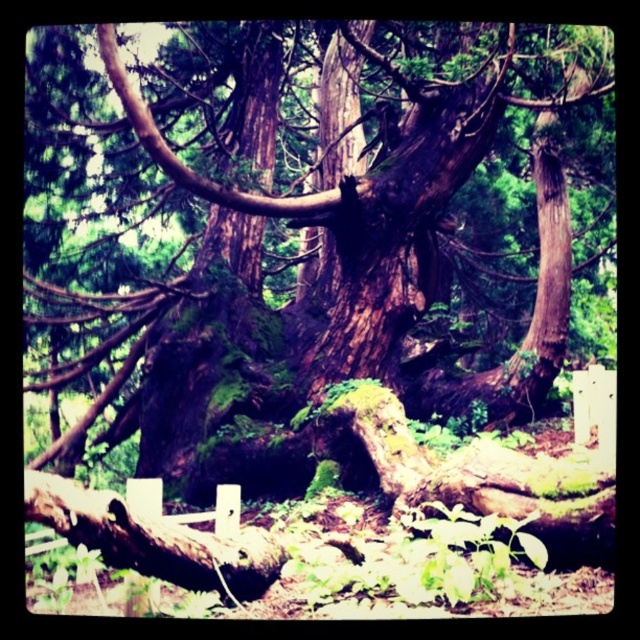
You are a hiker trying to determine which object in the scene is bigger between the dark brown bark tree at center and the brown rough tree trunk at center. Based on the scene, can you tell which one is larger?

The dark brown bark tree at center is larger in size than the brown rough tree trunk at center, so the dark brown bark tree at center is bigger.